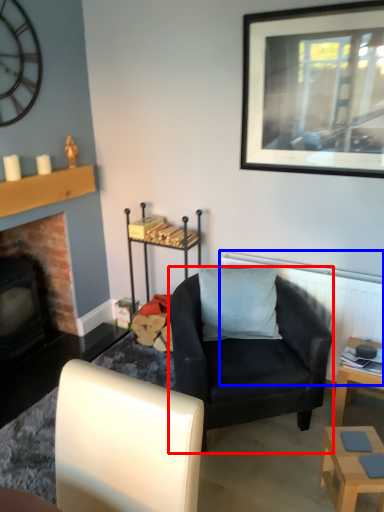
Question: Which of the following is the farthest to the observer, chair (highlighted by a red box) or radiator (highlighted by a blue box)?

Choices:
 (A) chair
 (B) radiator

Answer: (B)